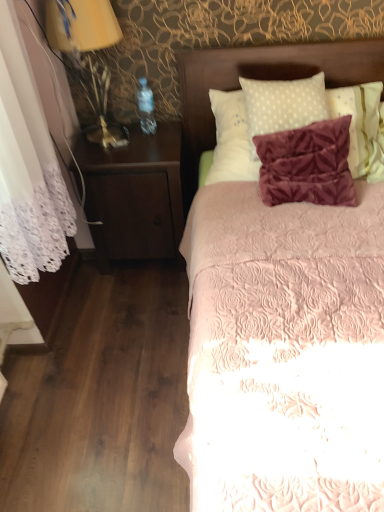
This screenshot has height=512, width=384. What do you see at coordinates (262, 79) in the screenshot?
I see `velvet brown headboard at upper center` at bounding box center [262, 79].

This screenshot has width=384, height=512. What do you see at coordinates (87, 50) in the screenshot?
I see `matte gold lamp at left` at bounding box center [87, 50].

What is the approximate height of matte gold lamp at left?

It is 21.98 inches.

The height and width of the screenshot is (512, 384). What do you see at coordinates (134, 195) in the screenshot?
I see `dark wood nightstand at left` at bounding box center [134, 195].

Identify the location of velvet brown headboard at upper center. (262, 79).

Which object is wider, velvet brown headboard at upper center or matte gold lamp at left?

velvet brown headboard at upper center.

Is velvet brown headboard at upper center behind matte gold lamp at left?

Yes, the depth of velvet brown headboard at upper center is greater than that of matte gold lamp at left.

Find the location of a particular element. This screenshot has height=512, width=384. bedside lamp above the velvet brown headboard at upper center (from the image's perspective) is located at coordinates (87, 50).

From a real-world perspective, which object rests below the other?

From a 3D spatial view, velvet brown headboard at upper center is below.

Is velvet brown headboard at upper center located within dark wood nightstand at left?

That's incorrect, velvet brown headboard at upper center is not inside dark wood nightstand at left.

Is point (161, 149) positioned after point (245, 73)?

Yes, it is behind point (245, 73).

From a real-world perspective, relative to velvet brown headboard at upper center, is dark wood nightstand at left vertically above or below?

In terms of real-world spatial position, dark wood nightstand at left is below velvet brown headboard at upper center.

Is dark wood nightstand at left at the right side of velvet brown headboard at upper center?

Incorrect, dark wood nightstand at left is not on the right side of velvet brown headboard at upper center.

Which is less distant, (205,94) or (189,130)?

Point (205,94) appears to be closer to the viewer than point (189,130).

From the image's perspective, who appears lower, velvet brown headboard at upper center or pink quilted bed at center?

pink quilted bed at center appears lower in the image.

At what (x,y) coordinates should I click in order to perform the action: click on headboard above the pink quilted bed at center (from a real-world perspective). Please return your answer as a coordinate pair (x, y). The width and height of the screenshot is (384, 512). Looking at the image, I should click on (262, 79).

Does pink quilted bed at center have a lesser width compared to matte gold lamp at left?

Incorrect, the width of pink quilted bed at center is not less than that of matte gold lamp at left.

From a real-world perspective, which is physically above, pink quilted bed at center or matte gold lamp at left?

matte gold lamp at left is physically above.

From the image's perspective, which one is positioned higher, pink quilted bed at center or matte gold lamp at left?

matte gold lamp at left appears higher in the image.

Considering the relative positions of pink quilted bed at center and matte gold lamp at left in the image provided, is pink quilted bed at center to the right of matte gold lamp at left from the viewer's perspective?

Yes, pink quilted bed at center is to the right of matte gold lamp at left.

Is matte gold lamp at left directly adjacent to velvet brown headboard at upper center?

matte gold lamp at left is not next to velvet brown headboard at upper center, and they're not touching.

Who is bigger, matte gold lamp at left or velvet brown headboard at upper center?

velvet brown headboard at upper center is bigger.

Does matte gold lamp at left lie in front of velvet brown headboard at upper center?

Yes, matte gold lamp at left is closer to the camera.

Who is smaller, pink quilted bed at center or velvet brown headboard at upper center?

velvet brown headboard at upper center is smaller.

Identify the location of bed below the velvet brown headboard at upper center (from a real-world perspective). The width and height of the screenshot is (384, 512). (261, 79).

Looking at this image, measure the distance from pink quilted bed at center to velvet brown headboard at upper center.

The distance of pink quilted bed at center from velvet brown headboard at upper center is 0.36 inches.

Is point (198, 76) closer or farther from the camera than point (353, 75)?

Clearly, point (198, 76) is more distant from the camera than point (353, 75).

From a real-world perspective, is dark wood nightstand at left over matte gold lamp at left?

Incorrect, from a real-world perspective, dark wood nightstand at left is lower than matte gold lamp at left.

Considering the sizes of dark wood nightstand at left and matte gold lamp at left in the image, is dark wood nightstand at left bigger or smaller than matte gold lamp at left?

Clearly, dark wood nightstand at left is larger in size than matte gold lamp at left.

Does dark wood nightstand at left have a greater width compared to matte gold lamp at left?

Yes, dark wood nightstand at left is wider than matte gold lamp at left.

Is dark wood nightstand at left at the right side of matte gold lamp at left?

Correct, you'll find dark wood nightstand at left to the right of matte gold lamp at left.

I want to click on headboard located below the matte gold lamp at left (from the image's perspective), so click(262, 79).

Locate an element on the screen. The image size is (384, 512). nightstand that is under the velvet brown headboard at upper center (from a real-world perspective) is located at coordinates (134, 195).

When comparing their distances from matte gold lamp at left, does dark wood nightstand at left or pink quilted bed at center seem closer?

Based on the image, dark wood nightstand at left appears to be nearer to matte gold lamp at left.

Looking at the image, which one is located further to pink quilted bed at center, dark wood nightstand at left or velvet brown headboard at upper center?

dark wood nightstand at left is further to pink quilted bed at center.

Looking at the image, which one is located further to matte gold lamp at left, velvet brown headboard at upper center or dark wood nightstand at left?

Based on the image, velvet brown headboard at upper center appears to be further to matte gold lamp at left.

From the image, which object appears to be nearer to dark wood nightstand at left, pink quilted bed at center or matte gold lamp at left?

matte gold lamp at left.

Estimate the real-world distances between objects in this image. Which object is closer to velvet brown headboard at upper center, pink quilted bed at center or dark wood nightstand at left?

Among the two, pink quilted bed at center is located nearer to velvet brown headboard at upper center.

Based on their spatial positions, is matte gold lamp at left or dark wood nightstand at left further from pink quilted bed at center?

matte gold lamp at left lies further to pink quilted bed at center than the other object.

Estimate the real-world distances between objects in this image. Which object is further from dark wood nightstand at left, matte gold lamp at left or velvet brown headboard at upper center?

velvet brown headboard at upper center.

Which object lies further to the anchor point velvet brown headboard at upper center, matte gold lamp at left or dark wood nightstand at left?

matte gold lamp at left is positioned further to the anchor velvet brown headboard at upper center.

Where is `bedside lamp positioned between pink quilted bed at center and dark wood nightstand at left from near to far`? This screenshot has width=384, height=512. bedside lamp positioned between pink quilted bed at center and dark wood nightstand at left from near to far is located at coordinates (87, 50).

Find the location of a particular element. This screenshot has width=384, height=512. headboard between pink quilted bed at center and dark wood nightstand at left in the front-back direction is located at coordinates (262, 79).

The width and height of the screenshot is (384, 512). Identify the location of nightstand between matte gold lamp at left and velvet brown headboard at upper center in the horizontal direction. (134, 195).

You are a GUI agent. You are given a task and a screenshot of the screen. Output one action in this format:
    pyautogui.click(x=<x>, y=<y>)
    Task: Click on the bedside lamp between pink quilted bed at center and velvet brown headboard at upper center along the z-axis
    This screenshot has height=512, width=384.
    Given the screenshot: What is the action you would take?
    pyautogui.click(x=87, y=50)